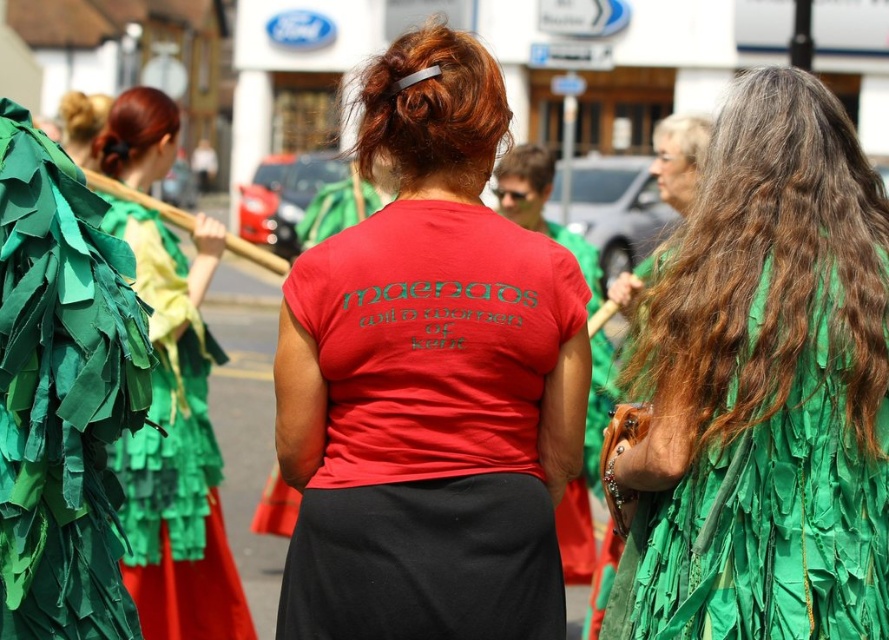
You are standing in the middle of the parade route and notice two points marked in the scene. The first point is at coordinate point (118, 630) and the second is at point (682, 131). Which point is nearer to you?

Point (118, 630) is closer to the viewer than point (682, 131).

You are a photographer trying to capture the central figure in the image. The central figure is wearing a red T shirt with the text Maenads Wild Women of Kent on the back. You need to focus your camera on the point at coordinate [685,136]. Where exactly on the central figure should you aim your camera?

The point at coordinate [685,136] is located on the gray straight hair at upper center of the central figure. Therefore, you should aim your camera at the gray straight hair at upper center of the central figure.